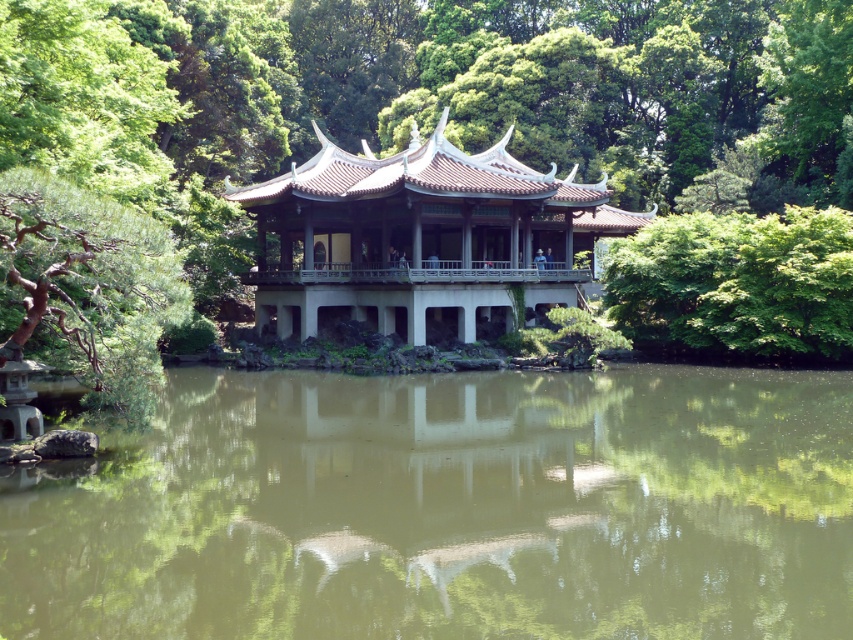
Between green leafy tree at center and matte gray gazebo at center, which one appears on the right side from the viewer's perspective?

green leafy tree at center

Can you confirm if green leafy tree at center is positioned to the right of matte gray gazebo at center?

Correct, you'll find green leafy tree at center to the right of matte gray gazebo at center.

Which is in front, point (613, 67) or point (297, 305)?

Point (297, 305)

This screenshot has width=853, height=640. What are the coordinates of `green leafy tree at center` in the screenshot? It's located at (581, 184).

Which is above, green reflective water at center or green leafy tree at center?

Positioned higher is green leafy tree at center.

Can you confirm if green reflective water at center is positioned to the left of green leafy tree at center?

Indeed, green reflective water at center is positioned on the left side of green leafy tree at center.

Describe the element at coordinates (451, 509) in the screenshot. I see `green reflective water at center` at that location.

This screenshot has width=853, height=640. In order to click on green reflective water at center in this screenshot , I will do `click(451, 509)`.

Which is behind, point (59, 576) or point (412, 157)?

Positioned behind is point (412, 157).

Can you confirm if green reflective water at center is positioned to the left of matte gray gazebo at center?

No, green reflective water at center is not to the left of matte gray gazebo at center.

Describe the element at coordinates (451, 509) in the screenshot. This screenshot has height=640, width=853. I see `green reflective water at center` at that location.

The width and height of the screenshot is (853, 640). Identify the location of green reflective water at center. (451, 509).